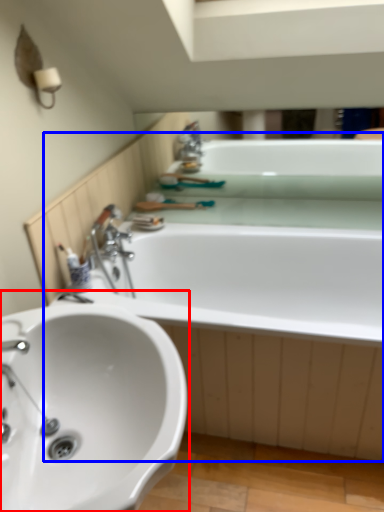
Question: Which of the following is the closest to the observer, sink (highlighted by a red box) or bath (highlighted by a blue box)?

Choices:
 (A) sink
 (B) bath

Answer: (A)